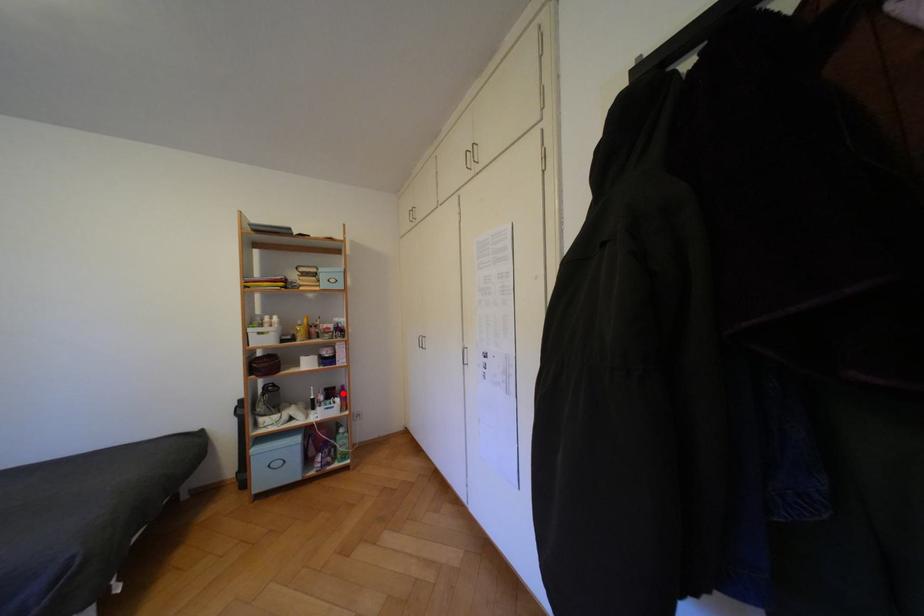
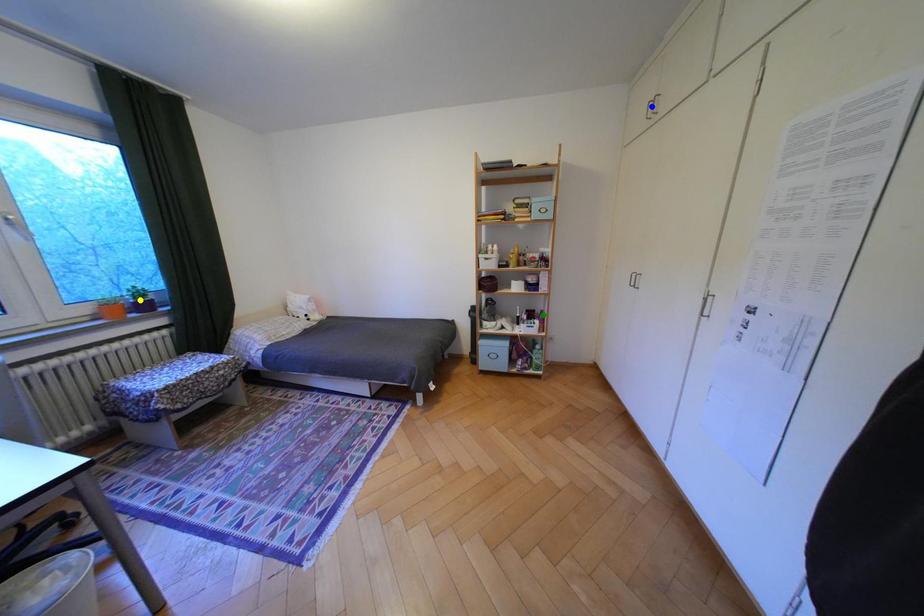
Question: I am providing you with two images of the same scene from different viewpoints. A red point is marked on the first image. You are given multiple points on the second image. Which mark in image 2 goes with the point in image 1?

Choices:
 (A) green point
 (B) yellow point
 (C) blue point

Answer: (A)